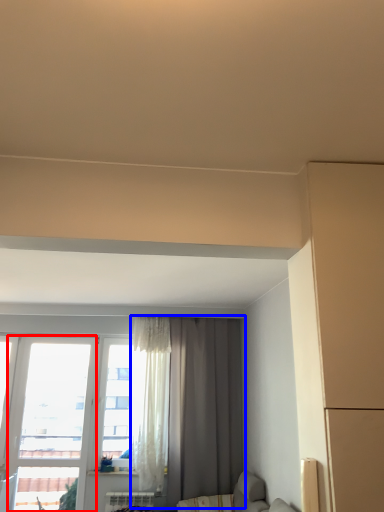
Question: Which point is further to the camera, window (highlighted by a red box) or curtain (highlighted by a blue box)?

Choices:
 (A) window
 (B) curtain

Answer: (A)